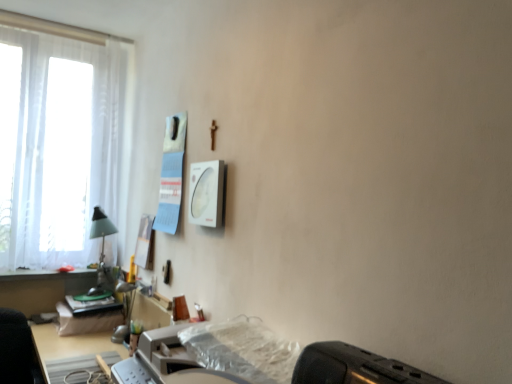
Question: From a real-world perspective, is translucent plastic printer at lower center over white sheer curtain at left?

Choices:
 (A) yes
 (B) no

Answer: (B)

Question: Are translucent plastic printer at lower center and white sheer curtain at left far apart?

Choices:
 (A) no
 (B) yes

Answer: (B)

Question: Can you confirm if translucent plastic printer at lower center is thinner than white sheer curtain at left?

Choices:
 (A) no
 (B) yes

Answer: (A)

Question: Considering the relative sizes of translucent plastic printer at lower center and white sheer curtain at left in the image provided, is translucent plastic printer at lower center shorter than white sheer curtain at left?

Choices:
 (A) yes
 (B) no

Answer: (A)

Question: Is translucent plastic printer at lower center wider than white sheer curtain at left?

Choices:
 (A) no
 (B) yes

Answer: (B)

Question: Considering the relative positions of translucent plastic printer at lower center and white sheer curtain at left in the image provided, is translucent plastic printer at lower center to the right of white sheer curtain at left from the viewer's perspective?

Choices:
 (A) yes
 (B) no

Answer: (A)

Question: Does black plastic toaster at lower right have a smaller size compared to white sheer curtain at left?

Choices:
 (A) no
 (B) yes

Answer: (B)

Question: Does black plastic toaster at lower right appear on the right side of white sheer curtain at left?

Choices:
 (A) yes
 (B) no

Answer: (A)

Question: Can we say black plastic toaster at lower right lies outside white sheer curtain at left?

Choices:
 (A) no
 (B) yes

Answer: (B)

Question: Is the position of black plastic toaster at lower right less distant than that of white sheer curtain at left?

Choices:
 (A) yes
 (B) no

Answer: (A)

Question: Could you tell me if black plastic toaster at lower right is facing white sheer curtain at left?

Choices:
 (A) no
 (B) yes

Answer: (A)

Question: Are black plastic toaster at lower right and white sheer curtain at left making contact?

Choices:
 (A) yes
 (B) no

Answer: (B)

Question: Can you confirm if black plastic toaster at lower right is taller than translucent plastic printer at lower center?

Choices:
 (A) yes
 (B) no

Answer: (B)